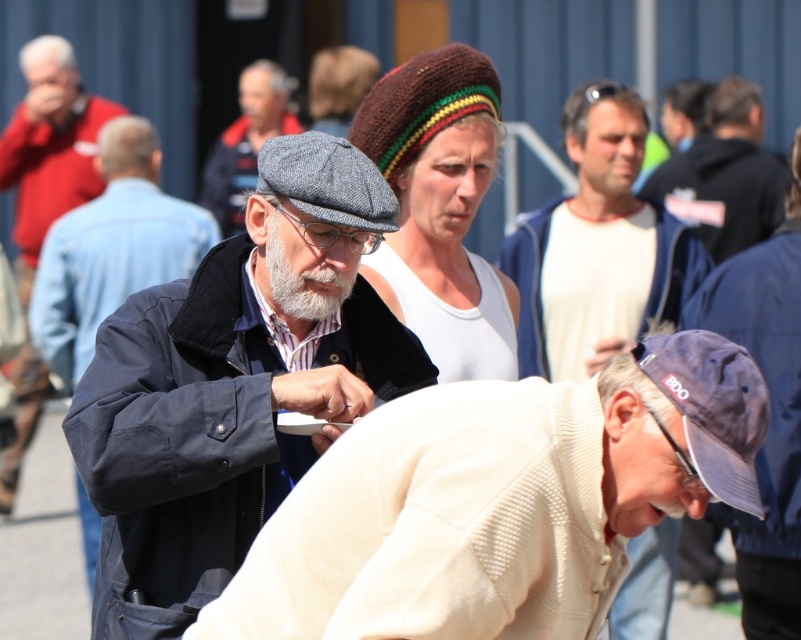
Does knitted woolen hat at center appear over graywoolbeard at center?

Correct, knitted woolen hat at center is located above graywoolbeard at center.

Does knitted woolen hat at center have a lesser width compared to graywoolbeard at center?

No.

Between point (457, 77) and point (316, 300), which one is positioned behind?

Point (457, 77)

This screenshot has width=801, height=640. In order to click on knitted woolen hat at center in this screenshot , I will do `click(421, 104)`.

Locate an element on the screen. The image size is (801, 640). dark blue jacket at left is located at coordinates (111, 248).

I want to click on dark blue jacket at left, so click(x=111, y=248).

Is blue fabric cap at lower right thinner than matte black jacket at center?

Yes.

Which is more to the right, blue fabric cap at lower right or matte black jacket at center?

From the viewer's perspective, blue fabric cap at lower right appears more on the right side.

Does point (699, 385) come in front of point (228, 198)?

Yes, point (699, 385) is closer to viewer.

You are a GUI agent. You are given a task and a screenshot of the screen. Output one action in this format:
    pyautogui.click(x=<x>, y=<y>)
    Task: Click on the blue fabric cap at lower right
    Image resolution: width=801 pixels, height=640 pixels.
    Given the screenshot: What is the action you would take?
    pyautogui.click(x=711, y=408)